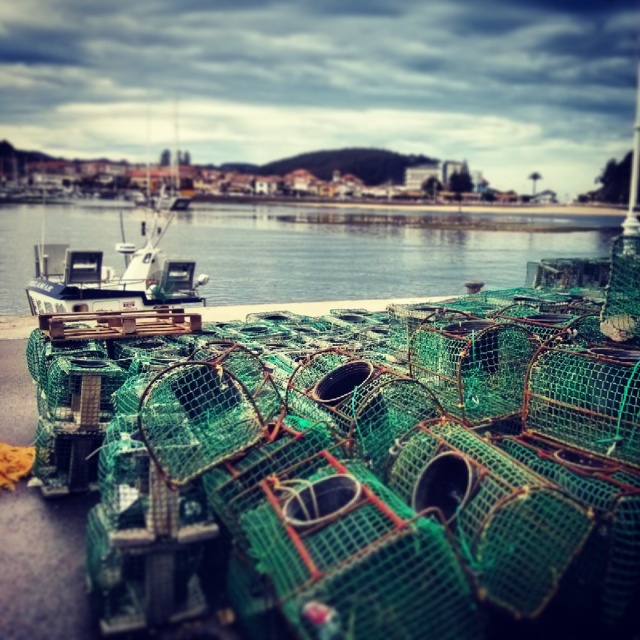
You are a photographer planning to capture the waterfront scene. You want to ensure that the clear blue water at center and the white plastic boat at center are both visible in your shot. Given that your camera can only focus on objects larger than 10 square meters, will both objects meet the size requirement?

The clear blue water at center is bigger than the white plastic boat at center. Since the camera requires objects larger than 10 square meters, and the water is larger, it likely meets the requirement. However, the boat may not if it is smaller than 10 square meters. Without exact measurements, we can only confirm the water meets the requirement, but the boat might not.

You are standing at the origin point of the image. You need to walk to the point at coordinates point (x=104, y=272) first, then proceed to point (x=16, y=237). Which direction should you face when moving from the first point to the second point?

When moving from point (x=104, y=272) to point (x=16, y=237), you should face a direction that is to the left and slightly upward since point (x=16, y=237) is behind point (x=104, y=272).